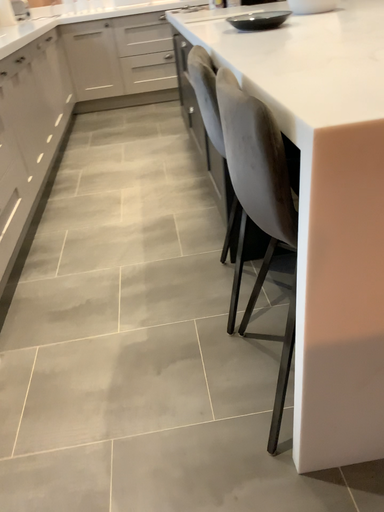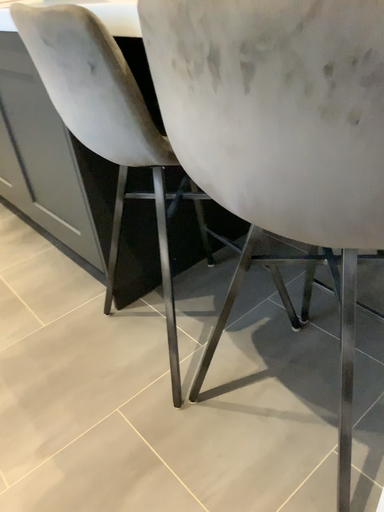
Question: How did the camera likely rotate when shooting the video?

Choices:
 (A) rotated right
 (B) rotated left

Answer: (A)